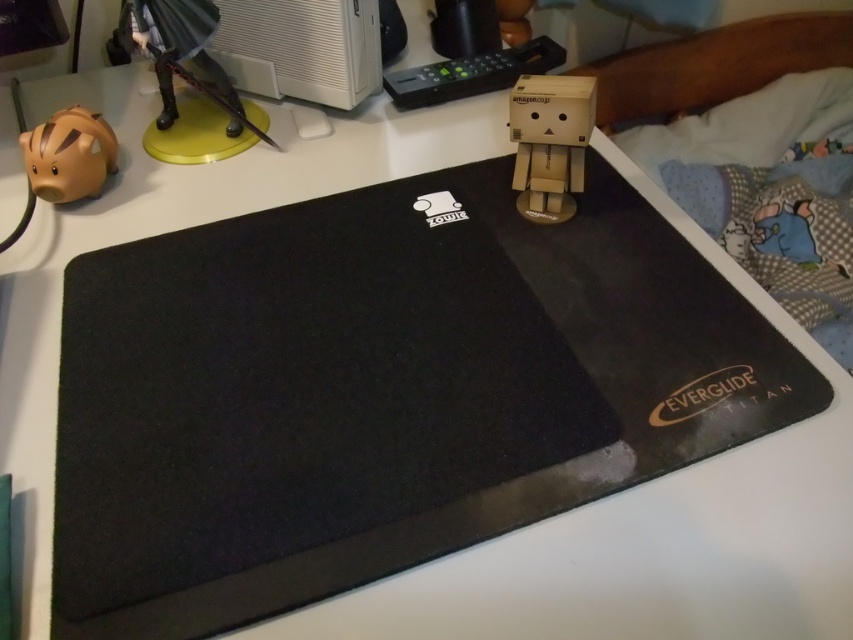
Where is `black fabric bed at upper right`? black fabric bed at upper right is located at coordinates (717, 65).

Locate an element on the screen. The height and width of the screenshot is (640, 853). black fabric bed at upper right is located at coordinates (717, 65).

The width and height of the screenshot is (853, 640). What do you see at coordinates (717, 65) in the screenshot?
I see `black fabric bed at upper right` at bounding box center [717, 65].

Does black fabric bed at upper right appear on the left side of yellow plastic figurine at upper left?

In fact, black fabric bed at upper right is to the right of yellow plastic figurine at upper left.

Does point (749, 54) lie in front of point (245, 125)?

No, (749, 54) is behind (245, 125).

Image resolution: width=853 pixels, height=640 pixels. I want to click on black fabric bed at upper right, so click(x=717, y=65).

Is cardboard figure at center taller than matte brown piggy bank at left?

Correct, cardboard figure at center is much taller as matte brown piggy bank at left.

Does cardboard figure at center have a lesser height compared to matte brown piggy bank at left?

Incorrect, cardboard figure at center's height does not fall short of matte brown piggy bank at left's.

Is point (567, 189) positioned behind point (62, 132)?

No, it is in front of (62, 132).

Image resolution: width=853 pixels, height=640 pixels. Identify the location of cardboard figure at center. (549, 141).